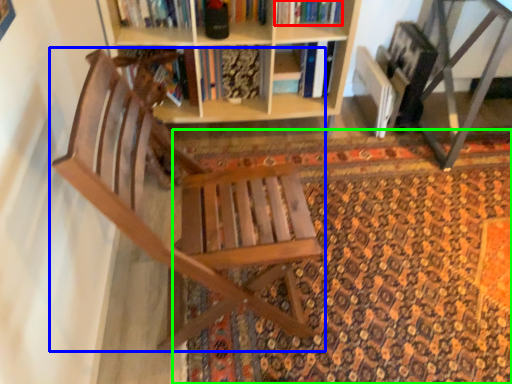
Question: Which object is the closest to the book (highlighted by a red box)? Choose among these: chair (highlighted by a blue box) or doormat (highlighted by a green box).

Choices:
 (A) chair
 (B) doormat

Answer: (B)